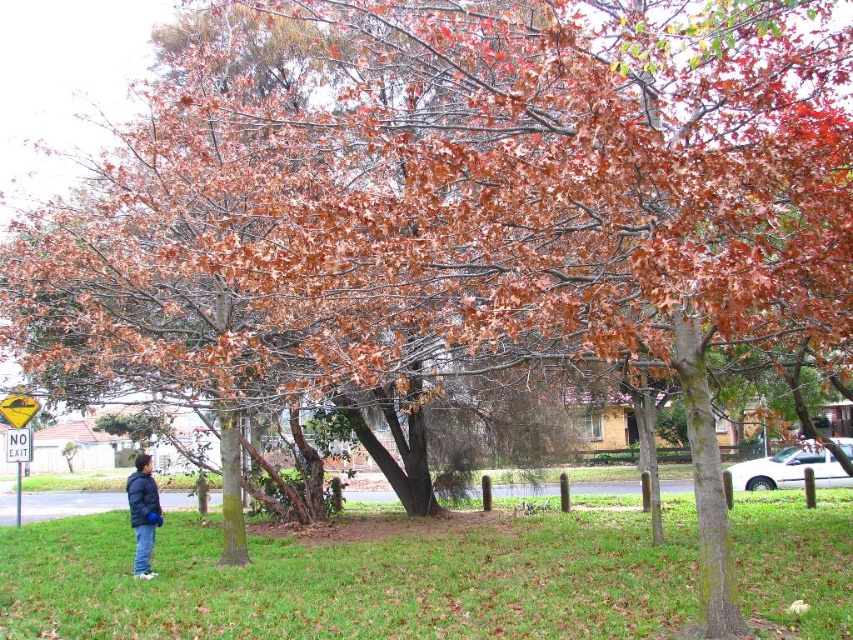
Is green grass at lower center smaller than yellow plastic traffic sign at upper left?

No.

Is green grass at lower center to the left of yellow plastic traffic sign at upper left from the viewer's perspective?

No, green grass at lower center is not to the left of yellow plastic traffic sign at upper left.

The image size is (853, 640). I want to click on green grass at lower center, so click(357, 580).

Does dark blue jacket at lower left have a greater height compared to yellow plastic traffic sign at upper left?

No, dark blue jacket at lower left is not taller than yellow plastic traffic sign at upper left.

Is dark blue jacket at lower left to the left of yellow plastic traffic sign at upper left from the viewer's perspective?

In fact, dark blue jacket at lower left is to the right of yellow plastic traffic sign at upper left.

Where is `dark blue jacket at lower left`? dark blue jacket at lower left is located at coordinates [143, 513].

Which is below, green grass at lower center or yellowmaterial/texturestreet sign at left?

Positioned lower is green grass at lower center.

Describe the element at coordinates (357, 580) in the screenshot. Image resolution: width=853 pixels, height=640 pixels. I see `green grass at lower center` at that location.

You are a GUI agent. You are given a task and a screenshot of the screen. Output one action in this format:
    pyautogui.click(x=<x>, y=<y>)
    Task: Click on the green grass at lower center
    This screenshot has height=640, width=853.
    Given the screenshot: What is the action you would take?
    pyautogui.click(x=357, y=580)